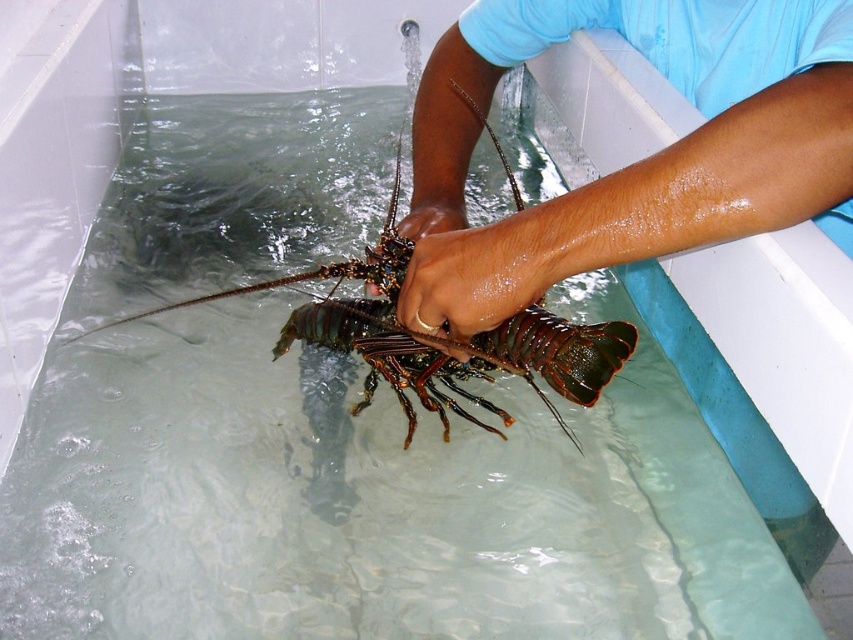
Does smooth skin hands at center lie behind smooth skin hand at center?

No, smooth skin hands at center is closer to the viewer.

Is smooth skin hands at center to the left of smooth skin hand at center from the viewer's perspective?

No, smooth skin hands at center is not to the left of smooth skin hand at center.

The width and height of the screenshot is (853, 640). Describe the element at coordinates (662, 193) in the screenshot. I see `smooth skin hands at center` at that location.

This screenshot has height=640, width=853. I want to click on smooth skin hands at center, so click(662, 193).

Is smooth skin hands at center closer to camera compared to glossy brown hand at center?

That is True.

Is smooth skin hands at center to the left of glossy brown hand at center from the viewer's perspective?

No, smooth skin hands at center is not to the left of glossy brown hand at center.

Between point (444, 189) and point (479, 237), which one is positioned behind?

The point (444, 189) is more distant.

This screenshot has width=853, height=640. What are the coordinates of `smooth skin hands at center` in the screenshot? It's located at (662, 193).

Between shiny metallic lobster at center and glossy brown hand at center, which one is positioned lower?

glossy brown hand at center is lower down.

Is shiny metallic lobster at center above glossy brown hand at center?

Indeed, shiny metallic lobster at center is positioned over glossy brown hand at center.

Which is in front, point (587, 380) or point (469, 330)?

Point (469, 330) is more forward.

This screenshot has height=640, width=853. I want to click on shiny metallic lobster at center, so click(x=437, y=337).